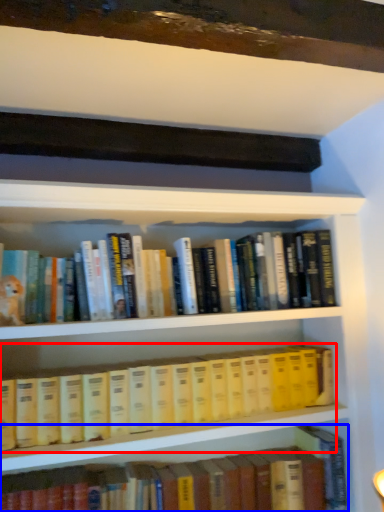
Question: Which of the following is the farthest to the observer, book (highlighted by a red box) or book (highlighted by a blue box)?

Choices:
 (A) book
 (B) book

Answer: (B)